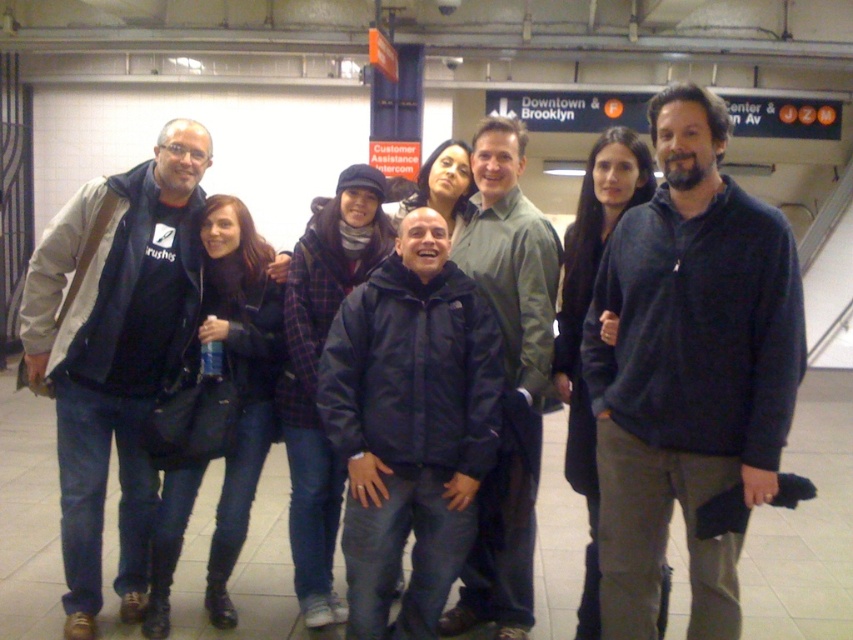
Can you confirm if brushed metal jacket at left is wider than navy blue jacket at center?

Correct, the width of brushed metal jacket at left exceeds that of navy blue jacket at center.

Can you confirm if brushed metal jacket at left is positioned to the left of navy blue jacket at center?

Correct, you'll find brushed metal jacket at left to the left of navy blue jacket at center.

This screenshot has height=640, width=853. What do you see at coordinates (115, 349) in the screenshot?
I see `brushed metal jacket at left` at bounding box center [115, 349].

Identify the location of brushed metal jacket at left. (115, 349).

Is dark blue fleece at center positioned before navy blue jacket at center?

That is True.

You are a GUI agent. You are given a task and a screenshot of the screen. Output one action in this format:
    pyautogui.click(x=<x>, y=<y>)
    Task: Click on the dark blue fleece at center
    The width and height of the screenshot is (853, 640).
    Given the screenshot: What is the action you would take?
    pyautogui.click(x=688, y=369)

Which is behind, point (709, 360) or point (142, 499)?

The point (142, 499) is more distant.

Which is below, dark blue fleece at center or brushed metal jacket at left?

brushed metal jacket at left

Locate an element on the screen. This screenshot has width=853, height=640. dark blue fleece at center is located at coordinates (688, 369).